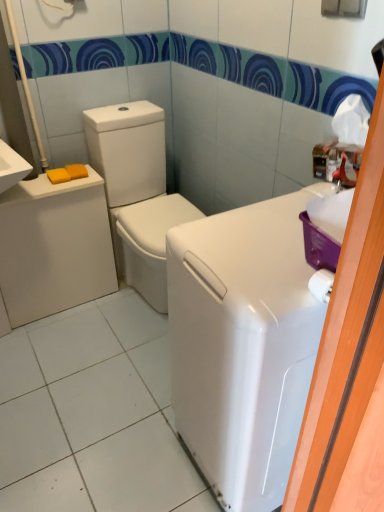
Question: Does point (84, 164) appear closer or farther from the camera than point (258, 506)?

Choices:
 (A) closer
 (B) farther

Answer: (B)

Question: Would you say yellow matte soap at left, placed as the 1th soap when sorted from right to left, is inside or outside white glossy washing machine at right?

Choices:
 (A) inside
 (B) outside

Answer: (B)

Question: Which of these objects is positioned farthest from the matte white porcelain at left?

Choices:
 (A) yellow matte soap at left, the 1th soap viewed from the left
 (B) white glossy washer at center
 (C) yellow matte soap at left, placed as the 1th soap when sorted from right to left
 (D) white glossy washing machine at right

Answer: (D)

Question: Which of these objects is positioned closest to the matte white porcelain at left?

Choices:
 (A) yellow matte soap at left, positioned as the second soap in right-to-left order
 (B) yellow matte soap at left, which is counted as the 2th soap, starting from the left
 (C) white glossy washer at center
 (D) white glossy washing machine at right

Answer: (C)